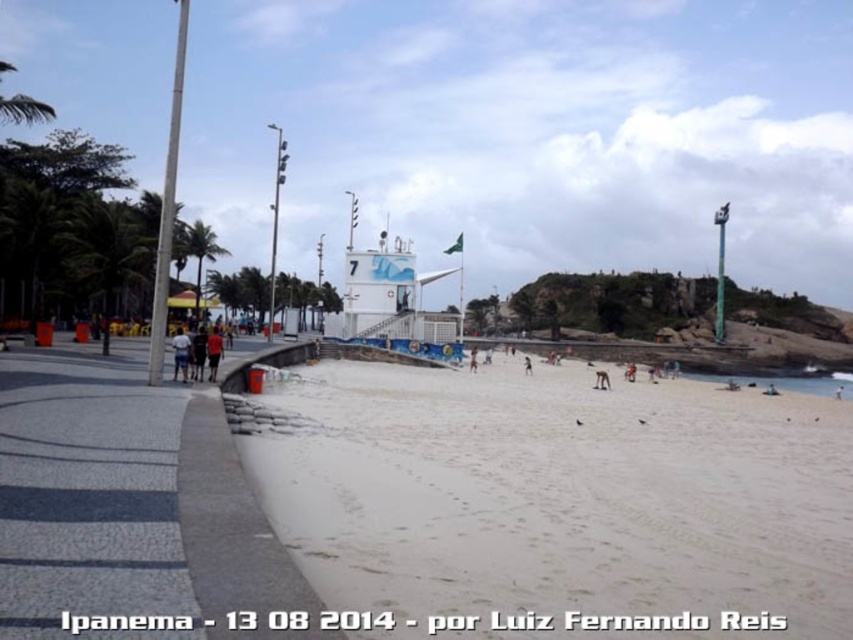
Question: Does white sand at center have a smaller size compared to dark red shirt at center?

Choices:
 (A) no
 (B) yes

Answer: (A)

Question: Which point is closer to the camera?

Choices:
 (A) white sand at center
 (B) light brown sand at center
 (C) dark red shirt at center
 (D) brown leather sandal at lower center

Answer: (A)

Question: Is white sand at center smaller than dark blue jeans at left?

Choices:
 (A) no
 (B) yes

Answer: (A)

Question: Which object is farther from the camera taking this photo?

Choices:
 (A) light brown sand at center
 (B) dark skin human at center

Answer: (B)

Question: Which point is farther to the camera?

Choices:
 (A) (192, 358)
 (B) (529, 369)
 (C) (190, 243)

Answer: (B)

Question: Where is white sand at center located in relation to brown leather sandal at lower center in the image?

Choices:
 (A) above
 (B) below

Answer: (B)